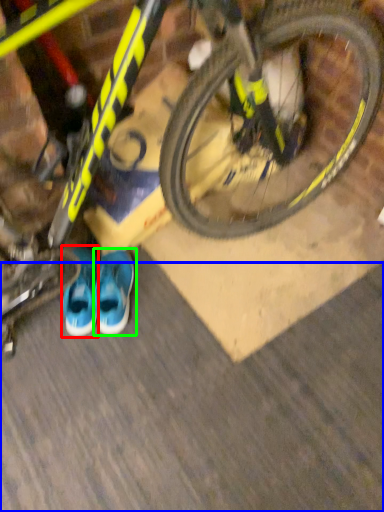
Question: Which is nearer to the footwear (highlighted by a red box)? dirt track (highlighted by a blue box) or running shoe (highlighted by a green box).

Choices:
 (A) dirt track
 (B) running shoe

Answer: (B)